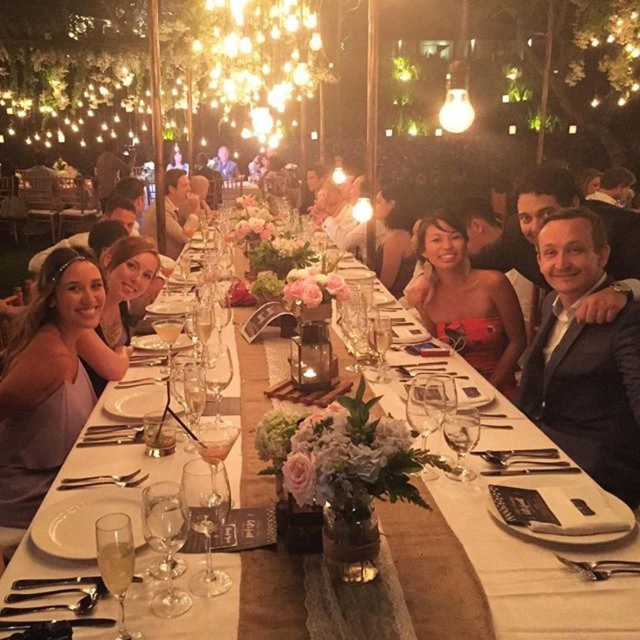
Question: Which object is the farthest from the matte purple dress at left?

Choices:
 (A) white ceramic plate at center
 (B) black suit at right
 (C) matte red dress at center

Answer: (B)

Question: Which point appears closest to the camera in this image?

Choices:
 (A) (632, 385)
 (B) (67, 387)

Answer: (A)

Question: Is matte purple dress at left closer to the viewer compared to white ceramic plate at center?

Choices:
 (A) yes
 (B) no

Answer: (B)

Question: Among these objects, which one is farthest from the camera?

Choices:
 (A) matte purple dress at left
 (B) black suit at right
 (C) matte red dress at center
 (D) white ceramic plate at center

Answer: (C)

Question: Can you confirm if matte purple dress at left is positioned below matte red dress at center?

Choices:
 (A) yes
 (B) no

Answer: (A)

Question: Is black suit at right bigger than matte purple dress at left?

Choices:
 (A) no
 (B) yes

Answer: (A)